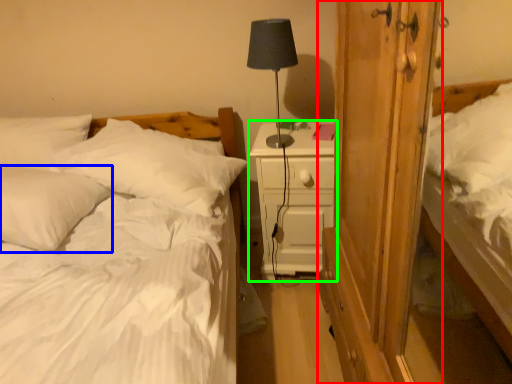
Question: Which is farther away from armoire (highlighted by a red box)? pillow (highlighted by a blue box) or nightstand (highlighted by a green box)?

Choices:
 (A) pillow
 (B) nightstand

Answer: (A)